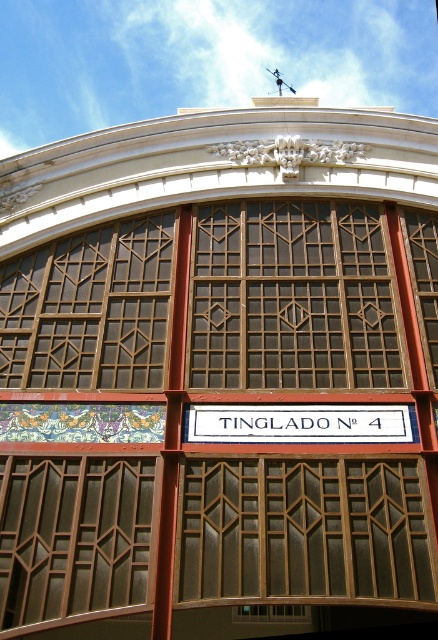
You are an architect analyzing the facade of Tinglado No. 4. You notice the brown wooden window at left and the white painted wood sign at center. Which object has a greater vertical height?

The brown wooden window at left is taller than the white painted wood sign at center.

You are an architect assessing the facade of Tinglado No. 4. You need to determine which object, the brown wooden window at left or the white painted wood sign at center, occupies more horizontal space. Based on the scene, which one is wider?

The brown wooden window at left has a lesser width compared to the white painted wood sign at center, so the white painted wood sign at center is wider.

You are a window cleaner standing at the base of Tinglado No. 4. You need to clean both the brown textured glass at center and the white painted wood sign at center. Your ladder can extend up to 4 meters. Can you reach both objects with your current ladder?

The distance between the brown textured glass at center and the white painted wood sign at center is 4.32 meters. Since your ladder can only extend up to 4 meters, you cannot reach both objects with your current ladder.